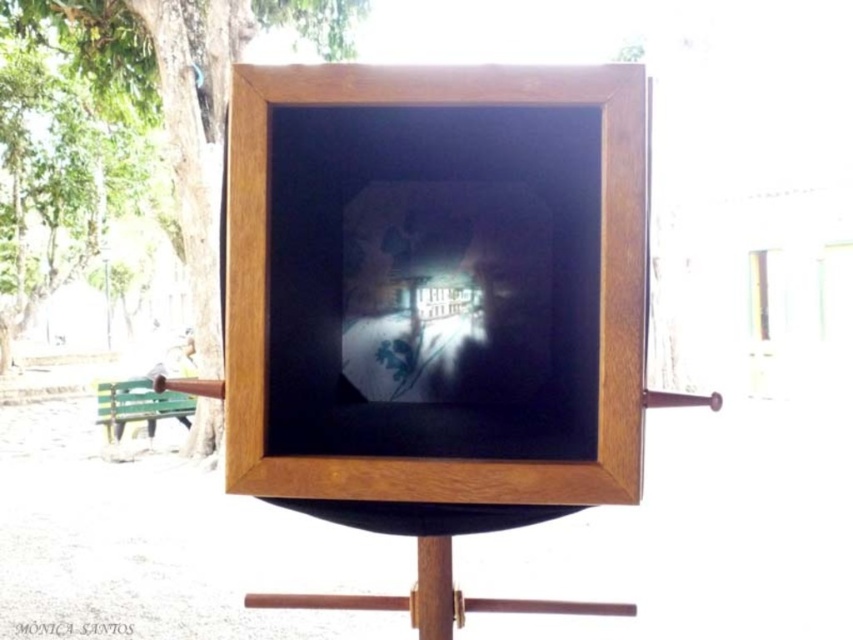
Question: Does smooth brown tree trunk at left have a smaller size compared to green painted wood park bench at lower left?

Choices:
 (A) no
 (B) yes

Answer: (A)

Question: Is smooth brown tree trunk at left wider than green painted wood park bench at lower left?

Choices:
 (A) no
 (B) yes

Answer: (B)

Question: Considering the relative positions of smooth brown tree trunk at left and green painted wood park bench at lower left in the image provided, where is smooth brown tree trunk at left located with respect to green painted wood park bench at lower left?

Choices:
 (A) left
 (B) right

Answer: (A)

Question: Among these objects, which one is farthest from the camera?

Choices:
 (A) smooth brown tree trunk at left
 (B) green painted wood park bench at lower left

Answer: (B)